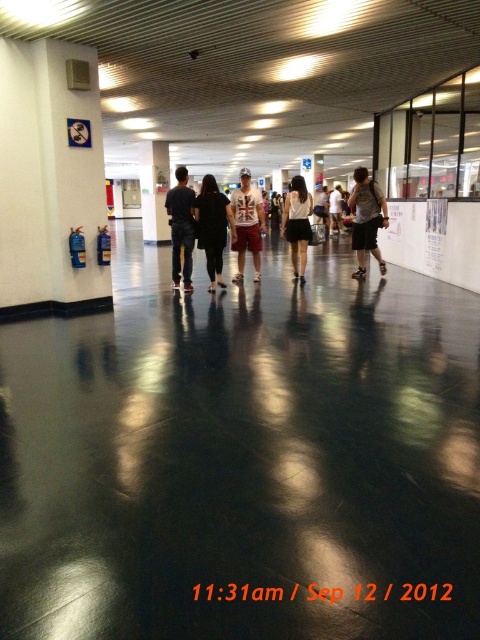
You are a photographer standing in the hallway and want to capture both the black matte jacket at center and the white matte dress at center in a single frame. Which object should you focus on first if you want to ensure both are in focus without moving the camera?

Since the black matte jacket at center is smaller in size compared to the white matte dress at center, you should focus on the black matte jacket at center first. Smaller objects require a narrower depth of field to keep both in focus.

You are a photographer trying to capture the white matte dress at center and the black matte roller skate at center in the hallway. Since the floor is reflective, you want to ensure that their reflections are visible. Which object will have a larger reflection on the floor?

The white matte dress at center has a larger size compared to the black matte roller skate at center, so its reflection on the floor will also be larger.

You are a photographer standing in the hallway and want to capture a photo of both the black matte jacket at center and the white matte dress at center. Which object will appear shorter in the photo?

The black matte jacket at center will appear shorter in the photo because it has a lesser height compared to the white matte dress at center.